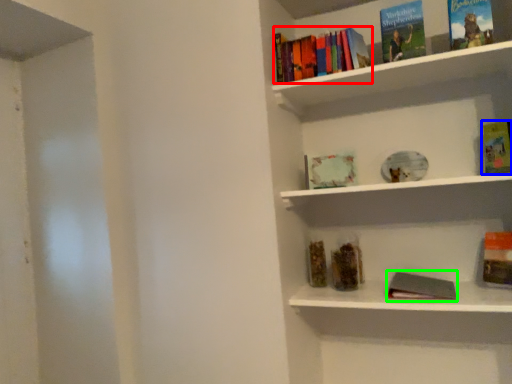
Question: Which is nearer to the book (highlighted by a red box)? book (highlighted by a blue box) or book (highlighted by a green box).

Choices:
 (A) book
 (B) book

Answer: (A)